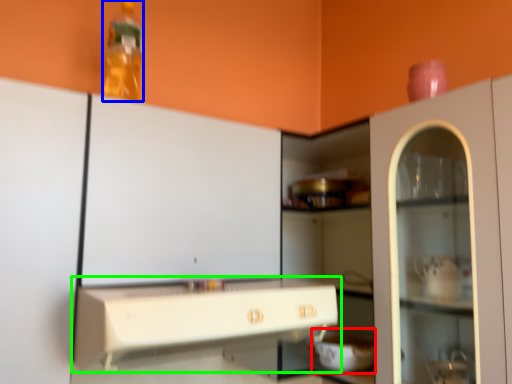
Question: Which is farther away from appliance (highlighted by a red box)? bottle (highlighted by a blue box) or countertop (highlighted by a green box)?

Choices:
 (A) bottle
 (B) countertop

Answer: (A)